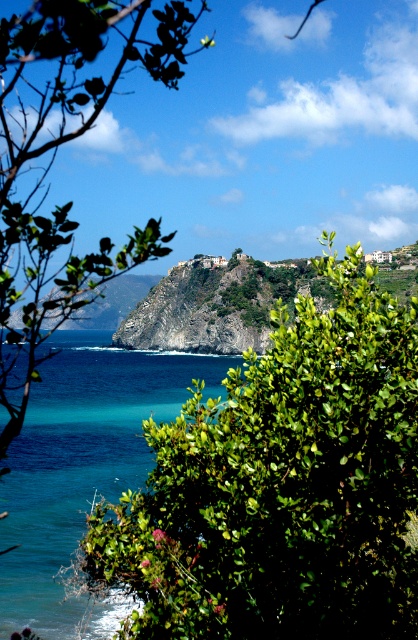
Question: Can you confirm if green leafy bush at center is thinner than green rocky cliff at center?

Choices:
 (A) no
 (B) yes

Answer: (B)

Question: Which object is positioned farthest from the green leafy bush at center?

Choices:
 (A) turquoise liquid at lower left
 (B) green rocky cliff at center

Answer: (B)

Question: Is green leafy bush at center to the left of green rocky cliff at center from the viewer's perspective?

Choices:
 (A) no
 (B) yes

Answer: (A)

Question: Which object is farther from the camera taking this photo?

Choices:
 (A) turquoise liquid at lower left
 (B) green rocky cliff at center
 (C) green leafy bush at center

Answer: (B)

Question: Is green leafy bush at center closer to camera compared to green rocky cliff at center?

Choices:
 (A) yes
 (B) no

Answer: (A)

Question: Estimate the real-world distances between objects in this image. Which object is closer to the green rocky cliff at center?

Choices:
 (A) green leafy bush at center
 (B) turquoise liquid at lower left

Answer: (B)